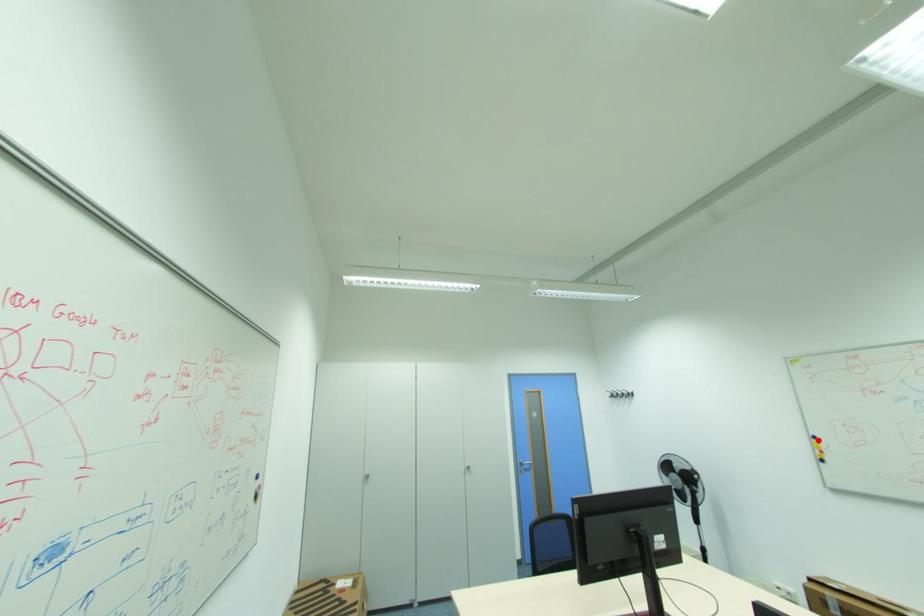
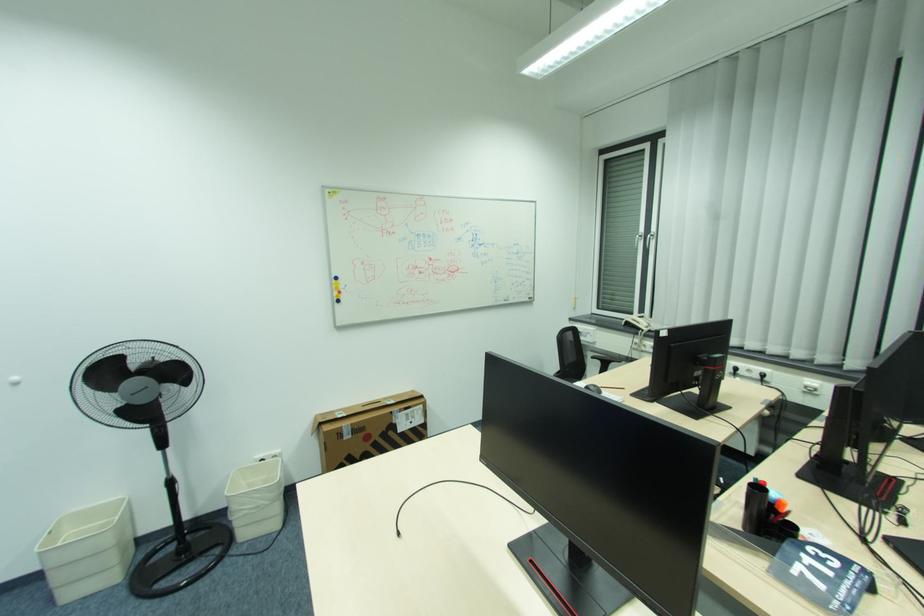
Question: I am providing you with two images of the same scene from different viewpoints. Given a red point in image1, look at the same physical point in image2. Is it:

Choices:
 (A) Closer to the viewpoint
 (B) Farther from the viewpoint

Answer: (B)